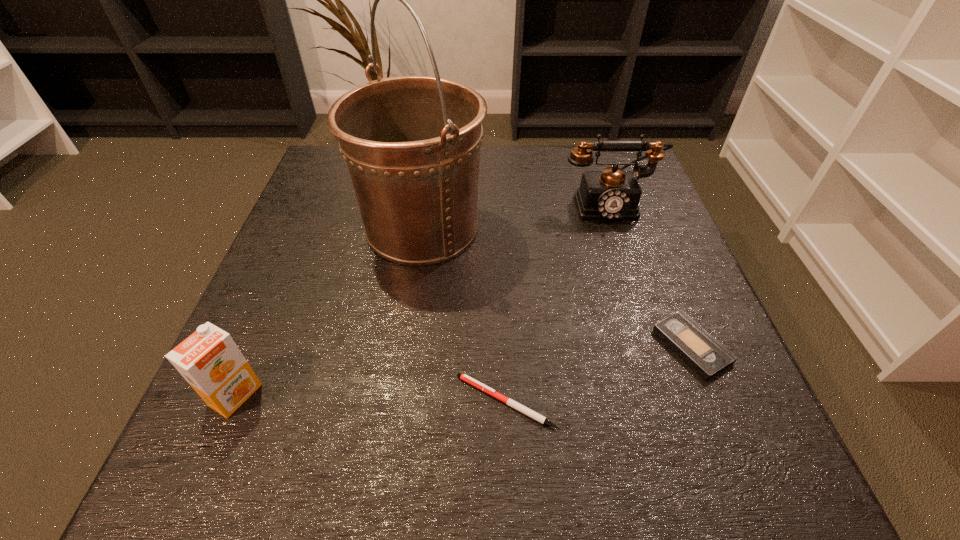
Locate an element on the screen. Image resolution: width=960 pixels, height=540 pixels. vacant region between the pen and the orange juice is located at coordinates (371, 398).

Locate an element on the screen. This screenshot has height=540, width=960. free spot between the pen and the fourth tallest object is located at coordinates (599, 374).

You are a GUI agent. You are given a task and a screenshot of the screen. Output one action in this format:
    pyautogui.click(x=<x>, y=<y>)
    Task: Click on the free space that is in between the videotape and the shortest object
    The image size is (960, 540).
    Given the screenshot: What is the action you would take?
    pyautogui.click(x=599, y=374)

What are the coordinates of `vacant space in between the shortest object and the fourth shortest object` in the screenshot? It's located at (557, 303).

The width and height of the screenshot is (960, 540). I want to click on vacant area that lies between the orange juice and the pen, so click(x=371, y=398).

You are a GUI agent. You are given a task and a screenshot of the screen. Output one action in this format:
    pyautogui.click(x=<x>, y=<y>)
    Task: Click on the free area in between the bucket and the shortest object
    The image size is (960, 540).
    Given the screenshot: What is the action you would take?
    pyautogui.click(x=465, y=314)

In order to click on object that stands as the fourth closest to the videotape in this screenshot , I will do `click(209, 360)`.

Select which object is the closest to the videotape. Please provide its 2D coordinates. Your answer should be formatted as a tuple, i.e. [(x, y)], where the tuple contains the x and y coordinates of a point satisfying the conditions above.

[(464, 377)]

This screenshot has height=540, width=960. Find the location of `blank area in the image that satisfies the following two spatial constraints: 1. on the front side of the second shortest object; 2. on the right side of the tallest object`. blank area in the image that satisfies the following two spatial constraints: 1. on the front side of the second shortest object; 2. on the right side of the tallest object is located at coordinates (406, 346).

Locate an element on the screen. free space that satisfies the following two spatial constraints: 1. on the front of the second tallest object at the rotary dial; 2. on the clicker of the shortest object is located at coordinates (674, 402).